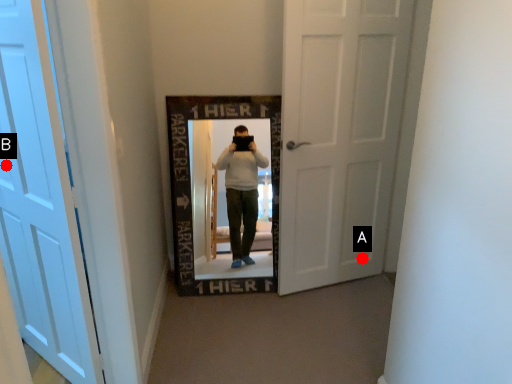
Question: Two points are circled on the image, labeled by A and B beside each circle. Among these points, which one is farthest from the camera?

Choices:
 (A) A is further
 (B) B is further

Answer: (A)